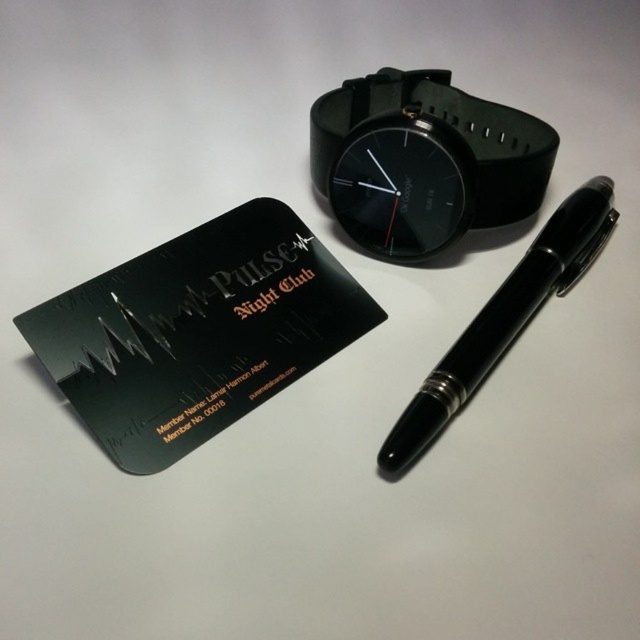
Question: Which object appears farthest from the camera in this image?

Choices:
 (A) black rubber watch at upper center
 (B) black matte business card at lower left

Answer: (A)

Question: Which of the following is the closest to the observer?

Choices:
 (A) black glossy pen at center
 (B) black matte business card at lower left

Answer: (B)

Question: Is black matte business card at lower left behind black glossy pen at center?

Choices:
 (A) no
 (B) yes

Answer: (A)

Question: Can you confirm if black rubber watch at upper center is bigger than black glossy pen at center?

Choices:
 (A) yes
 (B) no

Answer: (B)

Question: Considering the relative positions of black matte business card at lower left and black rubber watch at upper center in the image provided, where is black matte business card at lower left located with respect to black rubber watch at upper center?

Choices:
 (A) above
 (B) below

Answer: (B)

Question: Which point is farther from the camera taking this photo?

Choices:
 (A) (532, 266)
 (B) (365, 236)
 (C) (60, 380)

Answer: (B)